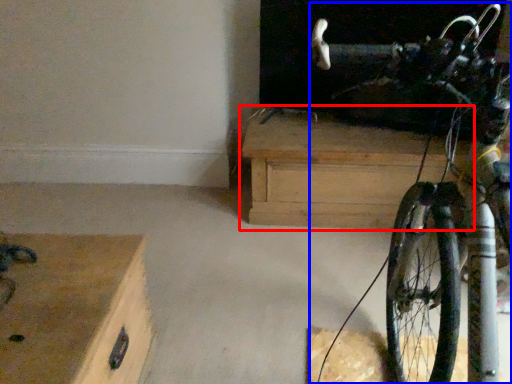
Question: Which object appears closest to the camera in this image, chest of drawers (highlighted by a red box) or bicycle (highlighted by a blue box)?

Choices:
 (A) chest of drawers
 (B) bicycle

Answer: (B)